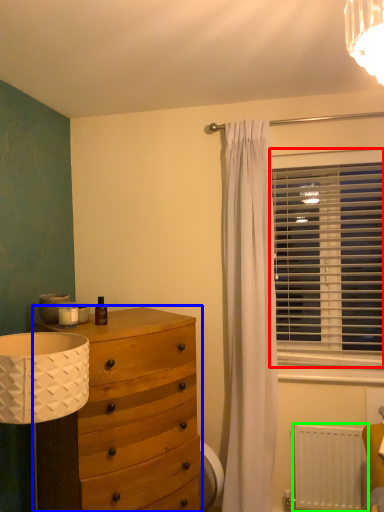
Question: Based on their relative distances, which object is nearer to window blind (highlighted by a red box)? Choose from chest of drawers (highlighted by a blue box) and radiator (highlighted by a green box).

Choices:
 (A) chest of drawers
 (B) radiator

Answer: (B)